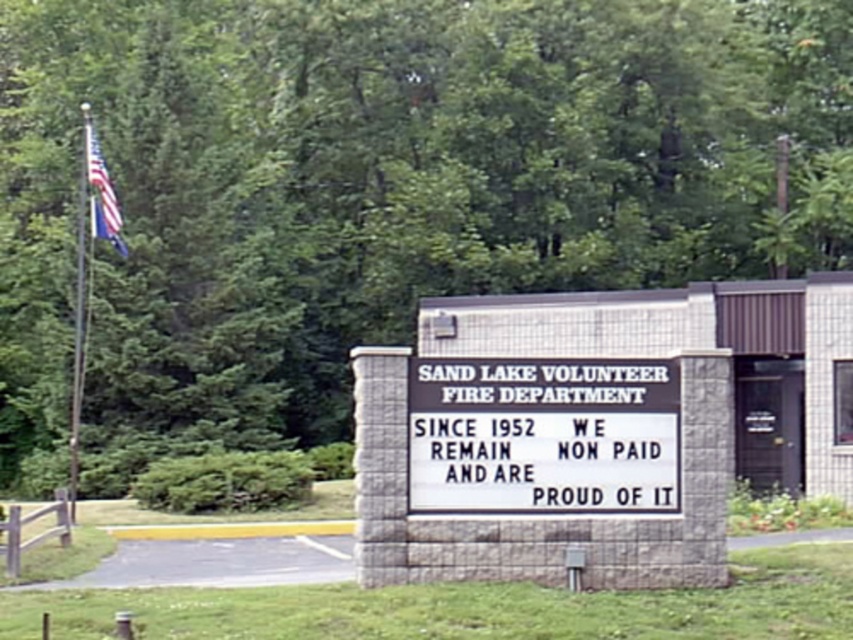
Question: Is white plastic sign at center below american flag at upper left?

Choices:
 (A) yes
 (B) no

Answer: (A)

Question: Which of the following is the closest to the observer?

Choices:
 (A) american flag at upper left
 (B) white plastic sign at center

Answer: (B)

Question: Is the position of white plastic sign at center more distant than that of american flag at upper left?

Choices:
 (A) yes
 (B) no

Answer: (B)

Question: Can you confirm if white plastic sign at center is positioned to the right of american flag at upper left?

Choices:
 (A) no
 (B) yes

Answer: (B)

Question: Which of the following is the farthest from the observer?

Choices:
 (A) white plastic sign at center
 (B) american flag at upper left

Answer: (B)

Question: Which point is closer to the camera taking this photo?

Choices:
 (A) (445, 390)
 (B) (112, 196)

Answer: (A)